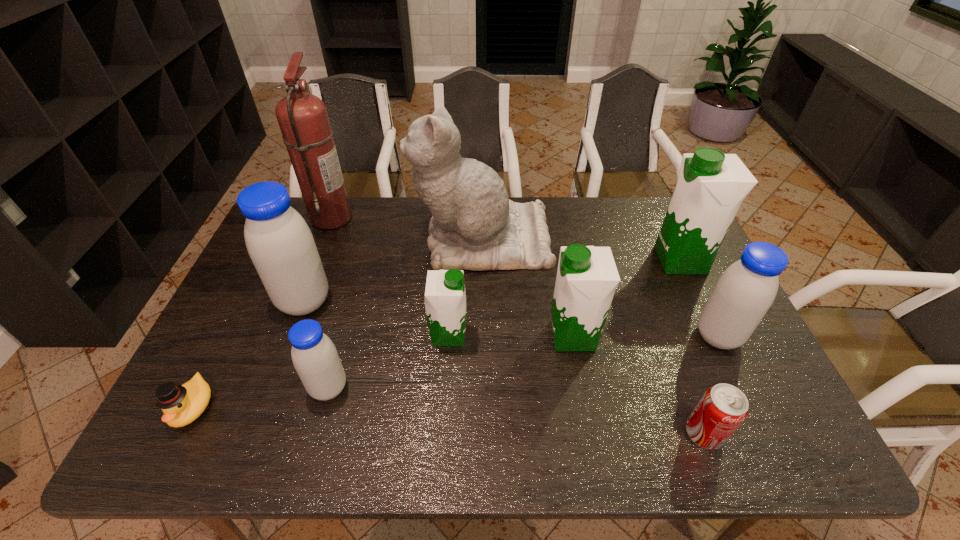
This screenshot has width=960, height=540. In order to click on fire extinguisher in this screenshot , I will do `click(303, 119)`.

Identify the location of cat. This screenshot has height=540, width=960. (475, 226).

The height and width of the screenshot is (540, 960). I want to click on the farthest green soya milk, so click(x=711, y=185).

Where is `the farthest soya milk`? the farthest soya milk is located at coordinates (711, 185).

This screenshot has width=960, height=540. I want to click on the leftmost soya milk, so pos(280,244).

The height and width of the screenshot is (540, 960). I want to click on the leftmost blue soya milk, so click(x=280, y=244).

The height and width of the screenshot is (540, 960). I want to click on the third soya milk from right to left, so click(587, 277).

Identify the location of the second green soya milk from left to right. (587, 277).

The height and width of the screenshot is (540, 960). Find the location of `the rightmost blue soya milk`. the rightmost blue soya milk is located at coordinates (745, 291).

Where is `the smallest green soya milk`? the smallest green soya milk is located at coordinates (445, 298).